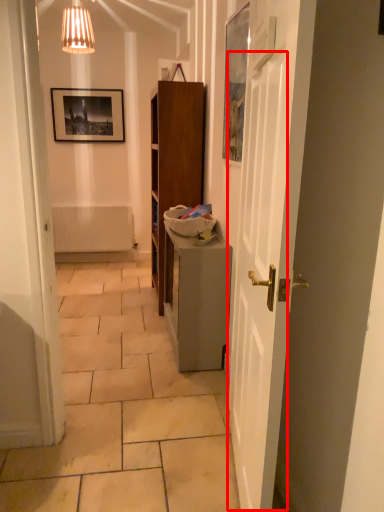
Question: From the image's perspective, what is the correct spatial relationship of door (annotated by the red box) in relation to table?

Choices:
 (A) below
 (B) above

Answer: (B)